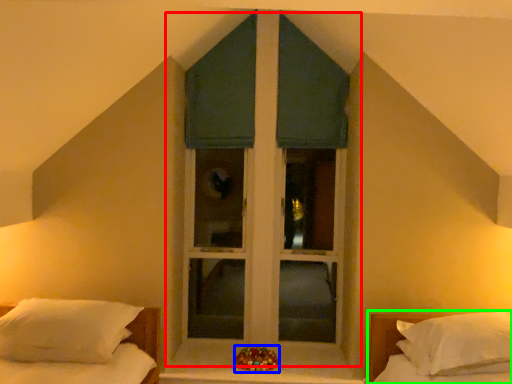
Question: Based on their relative distances, which object is nearer to window (highlighted by a red box)? Choose from miniature (highlighted by a blue box) and bed (highlighted by a green box).

Choices:
 (A) miniature
 (B) bed

Answer: (A)